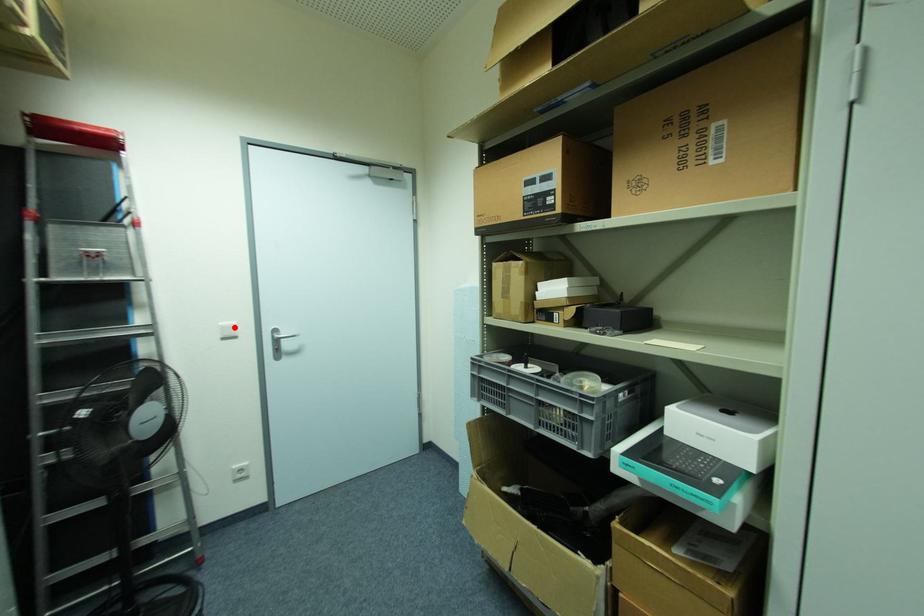
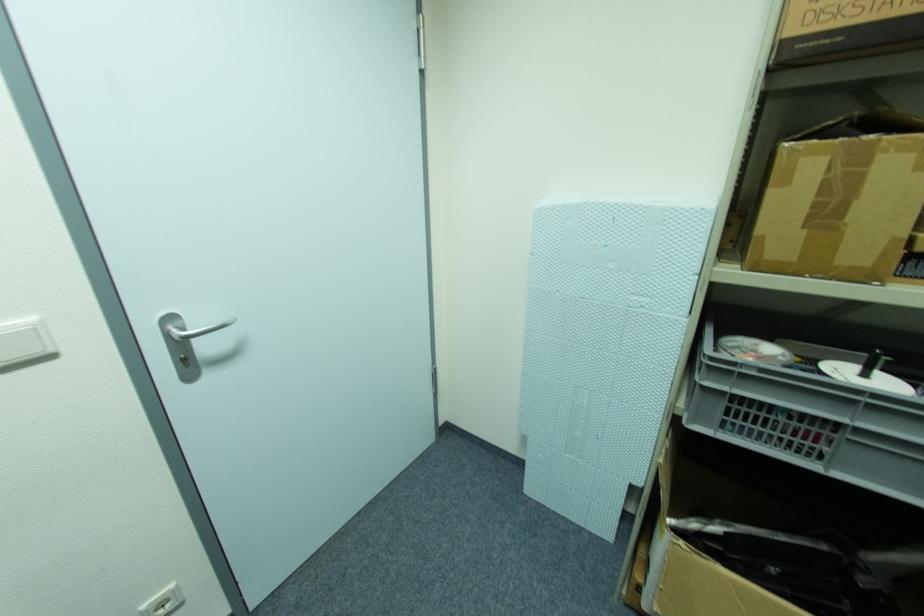
Locate, in the second image, the point that corresponds to the highlighted location in the first image.

(34, 331)